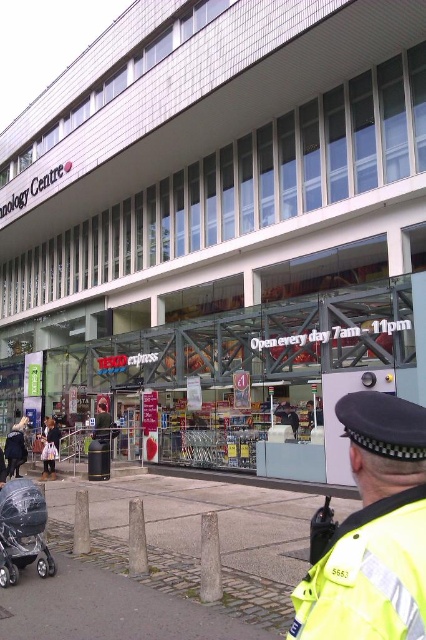
You are standing in front of the Tesco Express building and see a person wearing a matte black coat at center and another wearing a dark gray jacket at center. Which clothing item is closer to you?

The matte black coat at center is closer to you because it is in front of the dark gray jacket at center.

You are a customer standing at the entrance of the Tesco Express store. You notice two people outside. One is wearing a yellow reflective uniform at lower right and the other has a dark gray jacket at center. Which person appears closer to you?

The yellow reflective uniform at lower right appears closer because smaller objects in the distance would typically appear smaller, but since it is smaller than the dark gray jacket at center, it might actually be farther away. Wait, this seems contradictory. Let me think again. In perspective, closer objects appear larger. Since the yellow uniform is smaller than the dark gray jacket, it must be farther away. Therefore, the dark gray jacket at center is closer. Hmm, maybe I need to rephrase. The answer is,